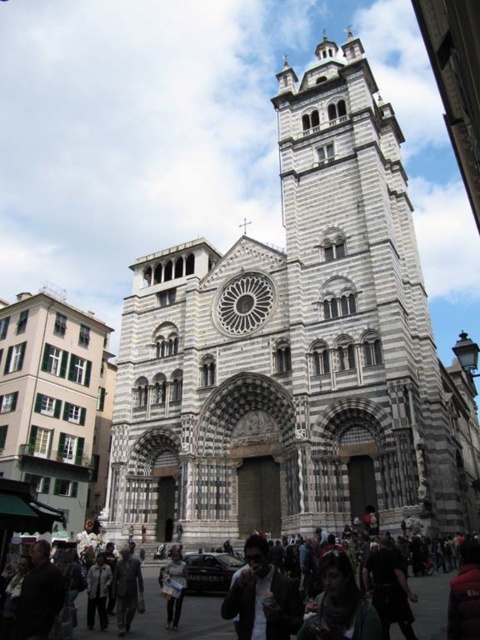
Does point (300, 628) come farther from viewer compared to point (469, 561)?

No, it is not.

Between green fabric scarf at center and dark red jacket at center, which one appears on the left side from the viewer's perspective?

Positioned to the left is green fabric scarf at center.

Describe the element at coordinates (339, 604) in the screenshot. This screenshot has width=480, height=640. I see `green fabric scarf at center` at that location.

Identify the location of green fabric scarf at center. This screenshot has width=480, height=640. (339, 604).

The image size is (480, 640). Describe the element at coordinates (296, 352) in the screenshot. I see `gray stone tower at center` at that location.

Who is more forward, (345, 205) or (192, 609)?

Positioned in front is point (192, 609).

What do you see at coordinates (296, 352) in the screenshot? The height and width of the screenshot is (640, 480). I see `gray stone tower at center` at bounding box center [296, 352].

I want to click on gray stone tower at center, so click(x=296, y=352).

Describe the element at coordinates (262, 596) in the screenshot. This screenshot has height=640, width=480. I see `matte black jacket at center` at that location.

Does point (267, 586) come in front of point (348, 632)?

No, (267, 586) is further to viewer.

You are a GUI agent. You are given a task and a screenshot of the screen. Output one action in this format:
    pyautogui.click(x=<x>, y=<y>)
    Task: Click on the matte black jacket at center
    
    Given the screenshot: What is the action you would take?
    pyautogui.click(x=262, y=596)